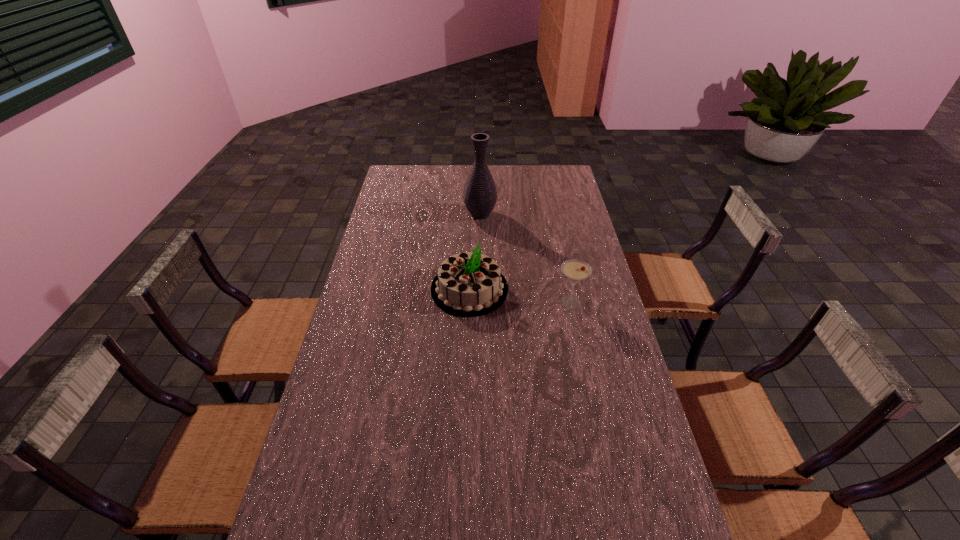
The width and height of the screenshot is (960, 540). I want to click on vase, so click(x=480, y=194).

The height and width of the screenshot is (540, 960). In order to click on the tallest object in this screenshot , I will do `click(480, 194)`.

The image size is (960, 540). Find the location of `birthday cake`. birthday cake is located at coordinates (469, 284).

Locate an element on the screen. the shortest object is located at coordinates (575, 270).

Find the location of a particular element. the rightmost object is located at coordinates (575, 270).

Locate an element on the screen. vacant space situated on the back of the tallest object is located at coordinates (480, 193).

The width and height of the screenshot is (960, 540). In order to click on vacant point located on the back of the birthday cake in this screenshot , I will do `click(471, 220)`.

Find the location of a particular element. free point located 0.170m on the back of the shortest object is located at coordinates click(562, 262).

This screenshot has height=540, width=960. Identify the location of object located at the right edge. (575, 270).

Locate an element on the screen. The image size is (960, 540). vacant space at the left edge is located at coordinates (296, 537).